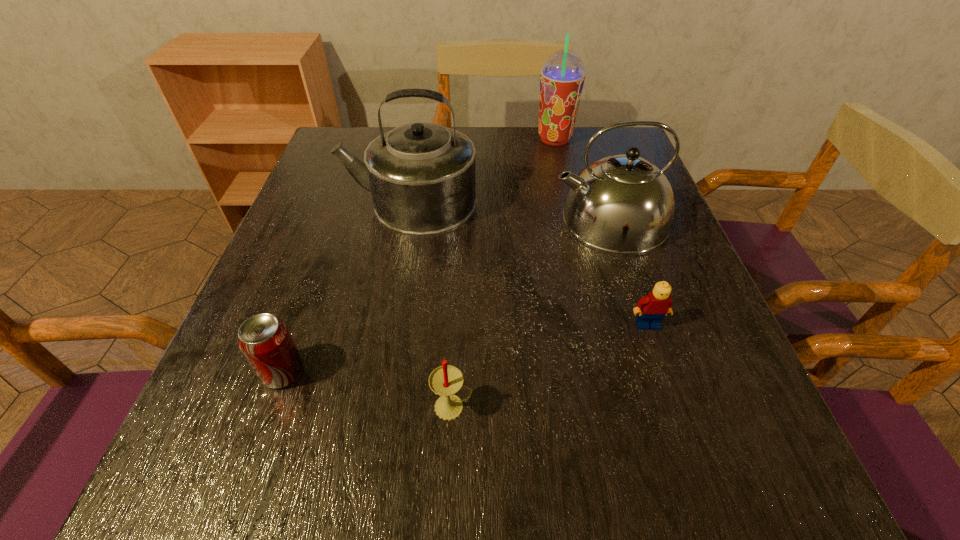
Locate an element on the screen. This screenshot has width=960, height=540. the fourth closest object to the smoothie is located at coordinates (446, 380).

The height and width of the screenshot is (540, 960). In order to click on vacant space that satisfies the following two spatial constraints: 1. on the back side of the smoothie; 2. on the right side of the candle in this screenshot , I will do `click(466, 140)`.